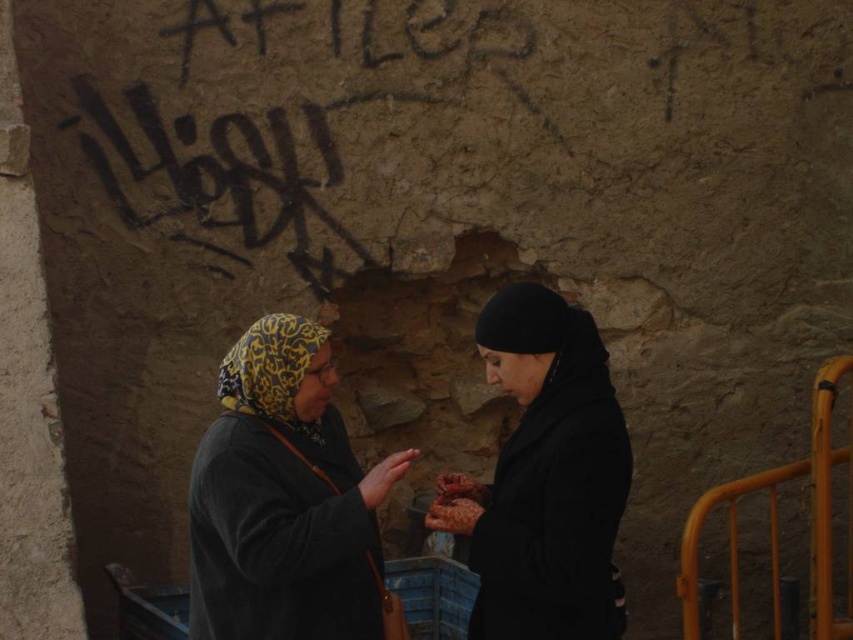
You are a photographer trying to capture both the yellow printed headscarf at center and the black matte coat at center in a single frame. Based on their positions, which object should you focus on first to ensure both are in the frame?

The black matte coat at center is behind the yellow printed headscarf at center, so you should focus on the yellow printed headscarf at center first to ensure both are visible in the frame.

You are a photographer standing at a distance of 10 feet from the wall. You want to take a closeup shot of the yellow printed headscarf at center without moving closer than your current position. Is this possible given the distance?

The yellow printed headscarf at center is 11.22 feet away from the camera. Since you are currently at 10 feet, you can move forward 1.22 feet to capture the closeup shot.

You are standing in front of the weathered wall with graffiti and see two points marked on the wall. The first point is at coordinates point [206,568] and the second point is at point [589,602]. Which point is closer to you?

Point [589,602] is closer to you because it is in front of point [206,568].